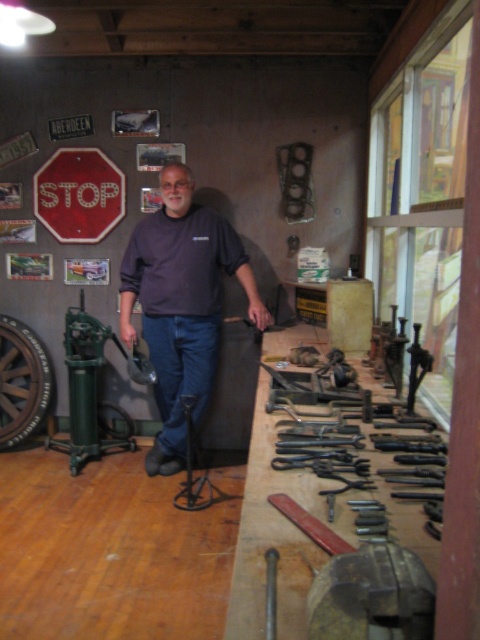
Who is positioned more to the right, red matte stop sign at center or metallic flat at center?

metallic flat at center is more to the right.

Is red matte stop sign at center thinner than metallic flat at center?

No, red matte stop sign at center is not thinner than metallic flat at center.

Does point (59, 173) come farther from viewer compared to point (275, 612)?

Yes, point (59, 173) is farther from viewer.

Locate an element on the screen. The image size is (480, 640). red matte stop sign at center is located at coordinates (79, 195).

Between dark blue shirt at center and green metal pump at left, which one is positioned lower?

green metal pump at left

Between dark blue shirt at center and green metal pump at left, which one appears on the right side from the viewer's perspective?

dark blue shirt at center

Between point (183, 284) and point (90, 445), which one is positioned in front?

Point (183, 284) is more forward.

Find the location of a particular element. This screenshot has width=480, height=640. dark blue shirt at center is located at coordinates (181, 305).

How far apart are red matte stop sign at center and green metal pump at left?

32.92 inches

Does red matte stop sign at center have a lesser width compared to green metal pump at left?

No.

Which is in front, point (60, 221) or point (148, 381)?

Point (148, 381) is more forward.

Where is `red matte stop sign at center`? The height and width of the screenshot is (640, 480). red matte stop sign at center is located at coordinates (79, 195).